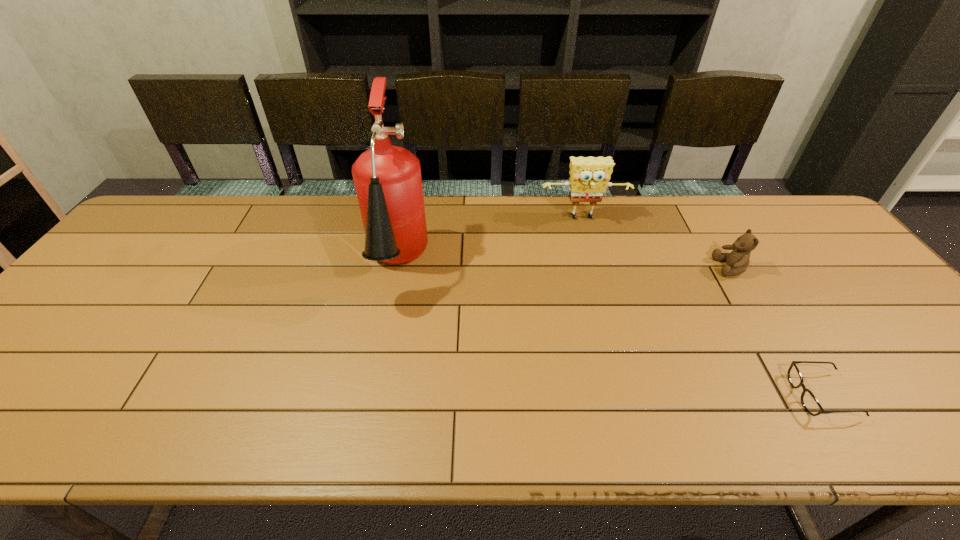
I want to click on vacant space that is in between the shortest object and the third object from right to left, so click(703, 307).

I want to click on vacant region between the nearest object and the third tallest object, so click(x=777, y=332).

At what (x,y) coordinates should I click in order to perform the action: click on vacant space that is in between the third object from right to left and the third tallest object. Please return your answer as a coordinate pair (x, y). Image resolution: width=960 pixels, height=540 pixels. Looking at the image, I should click on (x=657, y=243).

This screenshot has height=540, width=960. Identify the location of the second closest object to the second tallest object. (387, 179).

Locate an element on the screen. The image size is (960, 540). object that stands as the second closest to the fire extinguisher is located at coordinates (737, 261).